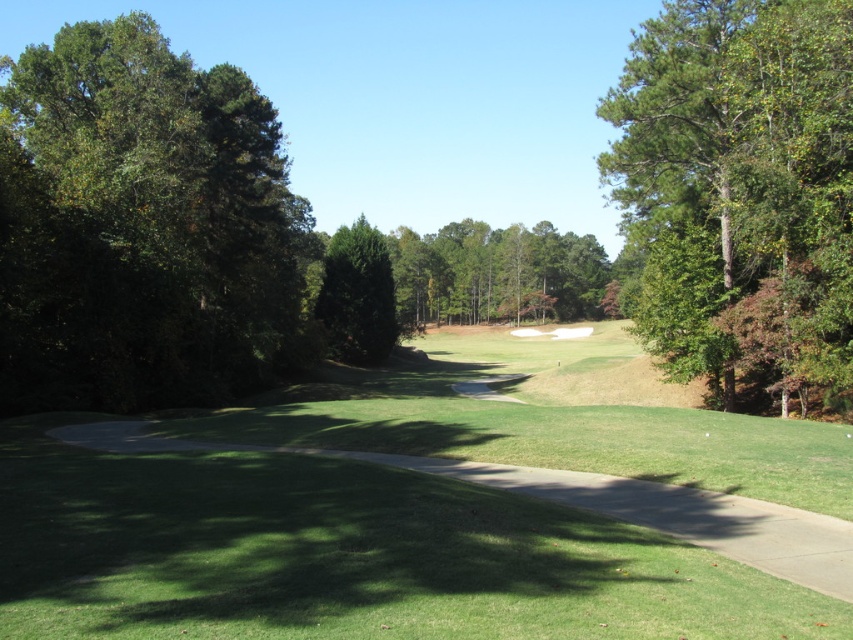
Based on the photo, is green leafy tree at left shorter than green leafy tree at center?

In fact, green leafy tree at left may be taller than green leafy tree at center.

Does point (9, 228) come in front of point (386, 284)?

Yes, it is.

Is point (196, 337) closer to camera compared to point (355, 232)?

Yes, point (196, 337) is in front of point (355, 232).

This screenshot has height=640, width=853. Identify the location of green leafy tree at left. (142, 227).

Is green leafy tree at left smaller than green leafy tree at upper right?

No.

Is point (35, 104) behind point (631, 80)?

Yes, point (35, 104) is behind point (631, 80).

Locate an element on the screen. This screenshot has width=853, height=640. green leafy tree at left is located at coordinates (142, 227).

Is the position of green grassy golf course at center less distant than that of green leafy tree at center?

That is True.

Between point (630, 342) and point (352, 253), which one is positioned in front?

Point (352, 253) is in front.

You are a GUI agent. You are given a task and a screenshot of the screen. Output one action in this format:
    pyautogui.click(x=<x>, y=<y>)
    Task: Click on the green grassy golf course at center
    Image resolution: width=853 pixels, height=640 pixels.
    Given the screenshot: What is the action you would take?
    pyautogui.click(x=343, y=556)